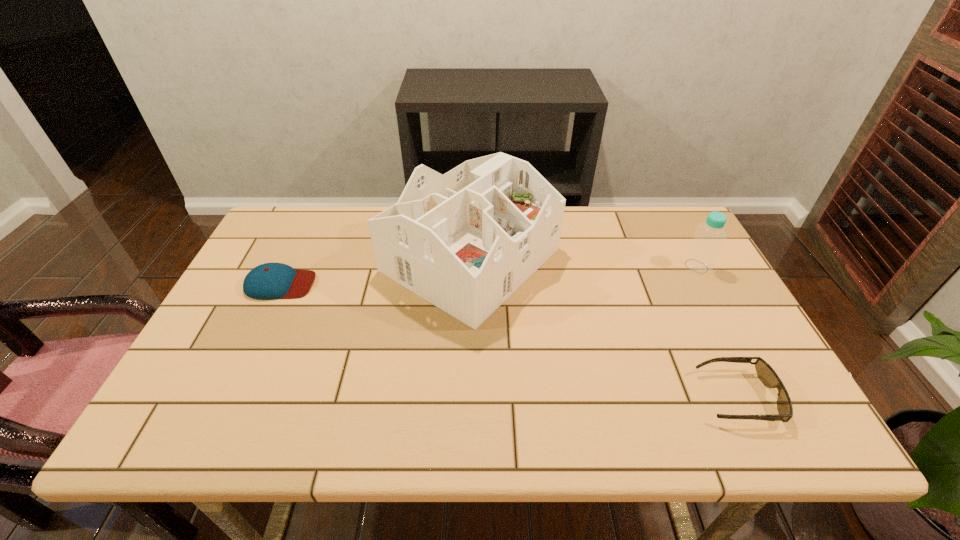
Identify the location of the third object from right to left. This screenshot has height=540, width=960. coord(465,241).

I want to click on the tallest object, so click(x=465, y=241).

Where is `the third shortest object`? The image size is (960, 540). the third shortest object is located at coordinates (702, 252).

Where is `the leftmost object`? This screenshot has height=540, width=960. the leftmost object is located at coordinates (267, 281).

Where is `the nearest object`? The height and width of the screenshot is (540, 960). the nearest object is located at coordinates (766, 374).

In order to click on vacant space located on the front of the second object from left to right in this screenshot , I will do `click(468, 382)`.

The height and width of the screenshot is (540, 960). I want to click on vacant region located on the left of the third shortest object, so click(634, 266).

At what (x,y) coordinates should I click in order to perform the action: click on vacant region located with the bill of the baseball cap facing forward. Please return your answer as a coordinate pair (x, y). Looking at the image, I should click on (444, 284).

You are a GUI agent. You are given a task and a screenshot of the screen. Output one action in this format:
    pyautogui.click(x=<x>, y=<y>)
    Task: Click on the vacant space situated 0.130m on the front-facing side of the nearest object
    
    Given the screenshot: What is the action you would take?
    pyautogui.click(x=641, y=397)

Find the location of `free space located 0.280m on the front-facing side of the nearest object`. free space located 0.280m on the front-facing side of the nearest object is located at coordinates (573, 397).